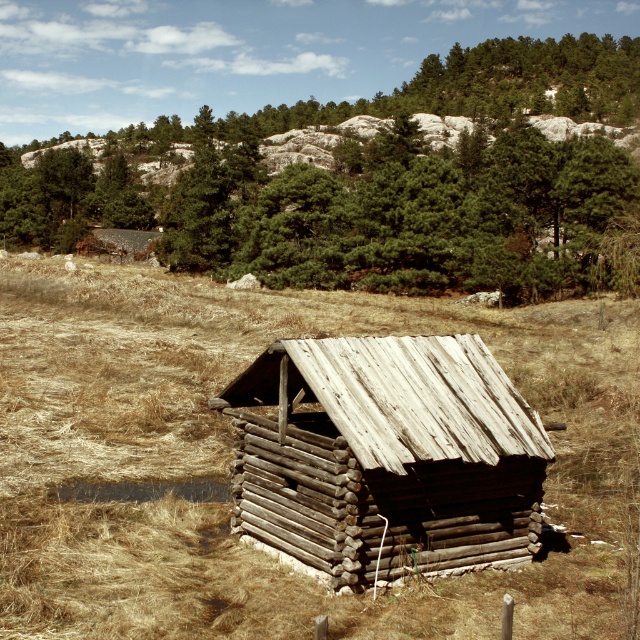
You are standing in front of the rustic log cabin and notice two points marked in the scene. The first point is at coordinates point (26, 196) and the second at point (320, 413). Which of these two points is closer to you?

Point (26, 196) is further to the camera than point (320, 413), so the point closer to you is point (320, 413).

You are standing in the open landscape and notice the brown dry grass at center and the weathered wood log cabin at center. Which object is closer to you?

The brown dry grass at center is closer to you because it is in front of the weathered wood log cabin at center.

You are planning to build a small garden in the area around the weathered wood log cabin at center. Given the brown dry grass at center is wider than the cabin, would you have enough space to place a garden bed that is as wide as the cabin on the grassy area?

The brown dry grass at center is wider than the weathered wood log cabin at center, so yes, there is enough space to place a garden bed as wide as the cabin on the grassy area.